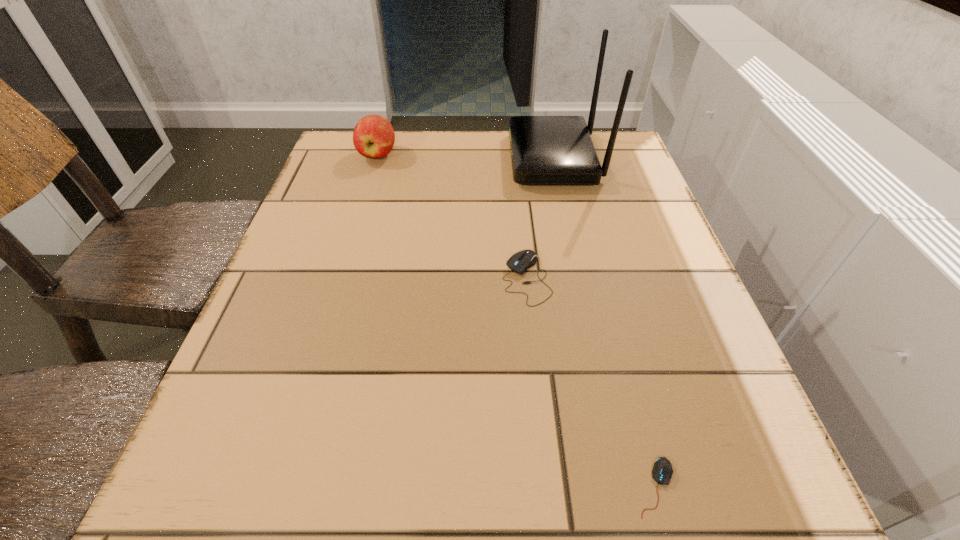
The width and height of the screenshot is (960, 540). Identify the location of free region located on the right of the apple. (547, 154).

The image size is (960, 540). What are the coordinates of `vacant space located 0.270m on the left of the taller mouse` in the screenshot? It's located at (356, 279).

Locate an element on the screen. Image resolution: width=960 pixels, height=540 pixels. vacant space located on the left of the shortest object is located at coordinates (374, 487).

Identify the location of router positioned at the far edge. (545, 150).

At what (x,y) coordinates should I click in order to perform the action: click on apple that is positioned at the far edge. Please return your answer as a coordinate pair (x, y). This screenshot has height=540, width=960. Looking at the image, I should click on (373, 137).

This screenshot has width=960, height=540. In order to click on object present at the near edge in this screenshot , I will do `click(662, 471)`.

I want to click on object that is at the left edge, so click(x=373, y=137).

You are a GUI agent. You are given a task and a screenshot of the screen. Output one action in this format:
    pyautogui.click(x=<x>, y=<y>)
    Task: Click on the router at the right edge
    This screenshot has height=540, width=960.
    Given the screenshot: What is the action you would take?
    pyautogui.click(x=545, y=150)

Where is `mouse located at the right edge`? This screenshot has height=540, width=960. mouse located at the right edge is located at coordinates (662, 471).

The image size is (960, 540). Find the location of `object located in the far left corner section of the desktop`. object located in the far left corner section of the desktop is located at coordinates (373, 137).